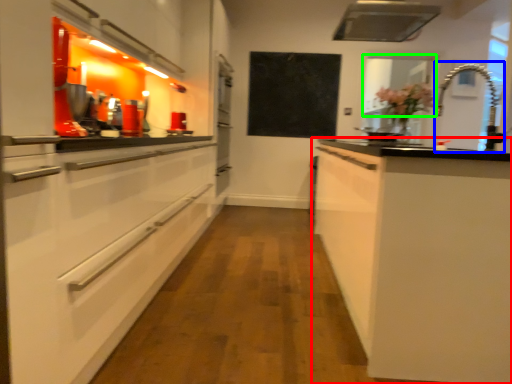
Question: Based on their relative distances, which object is farther from cabinetry (highlighted by a red box)? Choose from faucet (highlighted by a blue box) and window screen (highlighted by a green box).

Choices:
 (A) faucet
 (B) window screen

Answer: (A)